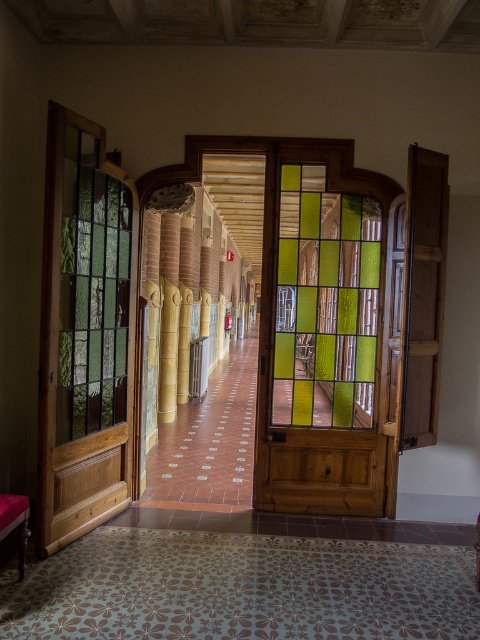
You are standing in the hallway and want to exit through the stained glass door at left. Based on your current position, where should you walk to reach it?

The stained glass door at left is located at coordinates 0.522 on the x axis and 0.175 on the y axis, so you should walk towards those coordinates to reach it.

You are standing in the hallway and want to determine the relative positions of two points marked in the image. Which point is closer to you, point [117,294] or point [105,301]?

Point [117,294] is closer to you because it is further to the viewer than point [105,301].